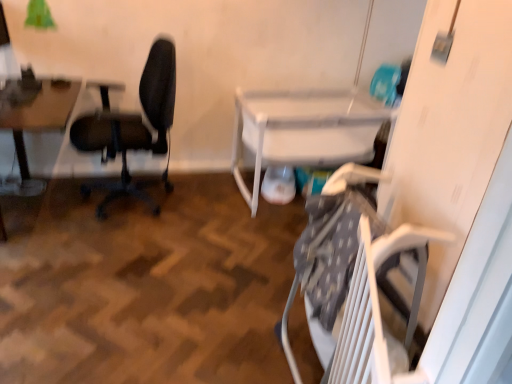
This screenshot has height=384, width=512. Identify the location of vacant space to the right of black matte office chair at left. (199, 211).